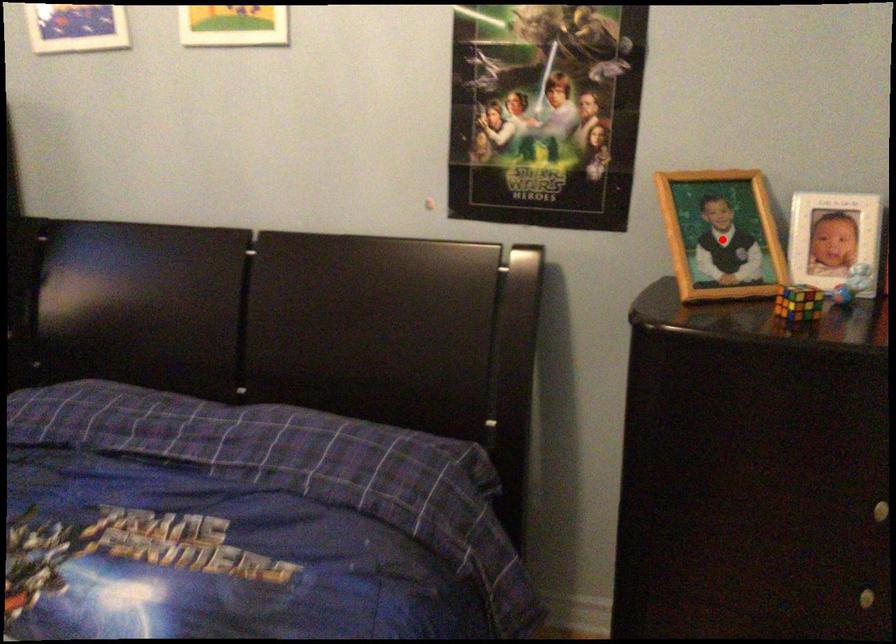
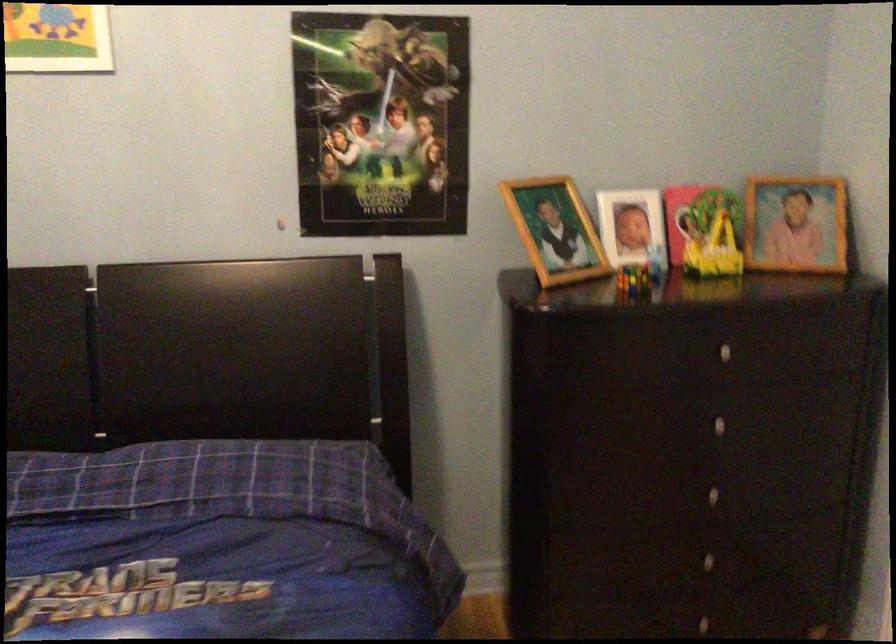
In the second image, find the point that corresponds to the highlighted location in the first image.

(555, 230)